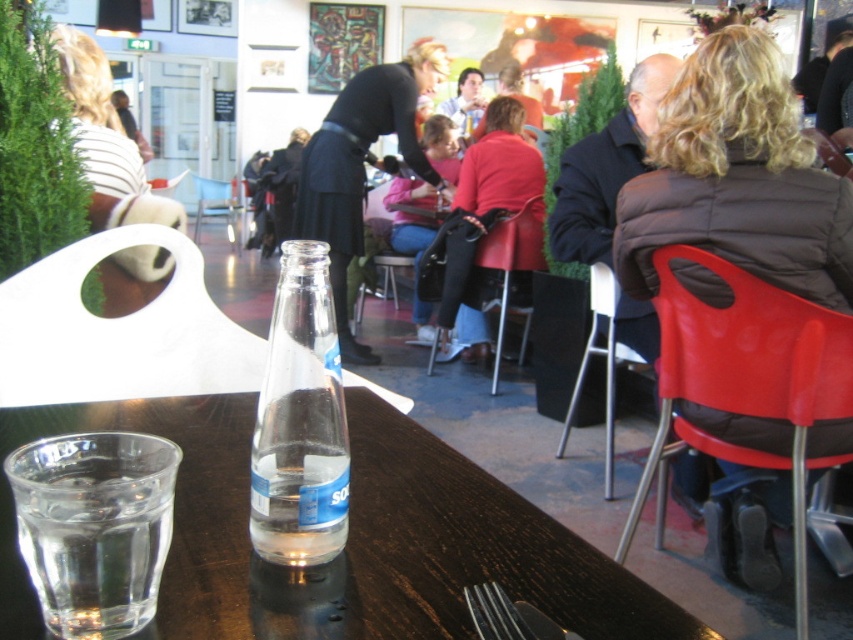
Between pink fabric jacket at center and metallic silver chair at center, which one is positioned higher?

metallic silver chair at center is higher up.

Does pink fabric jacket at center lie behind metallic silver chair at center?

No, pink fabric jacket at center is in front of metallic silver chair at center.

Which is in front, point (451, 164) or point (216, 212)?

Point (451, 164) is in front.

This screenshot has height=640, width=853. I want to click on pink fabric jacket at center, so click(422, 189).

Can you confirm if white striped shirt at upper left is positioned to the right of pink fabric jacket at center?

In fact, white striped shirt at upper left is to the left of pink fabric jacket at center.

Between white striped shirt at upper left and pink fabric jacket at center, which one is positioned lower?

Positioned lower is white striped shirt at upper left.

Is point (109, 177) positioned after point (412, 236)?

No, (109, 177) is closer to viewer.

Locate an element on the screen. The image size is (853, 640). white striped shirt at upper left is located at coordinates (96, 116).

In the scene shown: Between clear glass water at lower left and clear glass bottle at center, which one has less height?

Standing shorter between the two is clear glass water at lower left.

Does clear glass water at lower left have a lesser height compared to clear glass bottle at center?

Correct, clear glass water at lower left is not as tall as clear glass bottle at center.

Where is `clear glass water at lower left`? The height and width of the screenshot is (640, 853). clear glass water at lower left is located at coordinates (94, 528).

This screenshot has height=640, width=853. I want to click on clear glass water at lower left, so click(94, 528).